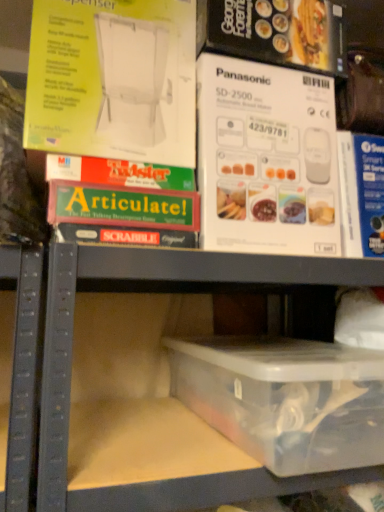
Question: From the image's perspective, would you say transparent plastic container at lower center is positioned over green matte board game at upper left?

Choices:
 (A) no
 (B) yes

Answer: (A)

Question: Considering the relative positions of transparent plastic container at lower center and green matte board game at upper left in the image provided, is transparent plastic container at lower center to the left of green matte board game at upper left from the viewer's perspective?

Choices:
 (A) no
 (B) yes

Answer: (A)

Question: Can you confirm if transparent plastic container at lower center is thinner than green matte board game at upper left?

Choices:
 (A) no
 (B) yes

Answer: (A)

Question: Is green matte board game at upper left at the back of transparent plastic container at lower center?

Choices:
 (A) no
 (B) yes

Answer: (A)

Question: From a real-world perspective, is transparent plastic container at lower center located higher than green matte board game at upper left?

Choices:
 (A) yes
 (B) no

Answer: (B)

Question: Is transparent plastic container at lower center taller than green matte board game at upper left?

Choices:
 (A) yes
 (B) no

Answer: (B)

Question: Does transparent plastic container at lower center have a larger size compared to green matte board game at upper left?

Choices:
 (A) yes
 (B) no

Answer: (A)

Question: Considering the relative sizes of transparent plastic container at lower center and green matte board game at upper left in the image provided, is transparent plastic container at lower center wider than green matte board game at upper left?

Choices:
 (A) yes
 (B) no

Answer: (A)

Question: Is transparent plastic container at lower center to the right of green matte board game at upper left from the viewer's perspective?

Choices:
 (A) no
 (B) yes

Answer: (B)

Question: Is transparent plastic container at lower center further to camera compared to green matte board game at upper left?

Choices:
 (A) no
 (B) yes

Answer: (A)

Question: Considering the relative sizes of transparent plastic container at lower center and green matte board game at upper left in the image provided, is transparent plastic container at lower center taller than green matte board game at upper left?

Choices:
 (A) no
 (B) yes

Answer: (B)

Question: Could you tell me if transparent plastic container at lower center is facing green matte board game at upper left?

Choices:
 (A) no
 (B) yes

Answer: (A)

Question: Is transparent plastic container at lower center outside of transparent plastic container at lower center?

Choices:
 (A) no
 (B) yes

Answer: (A)